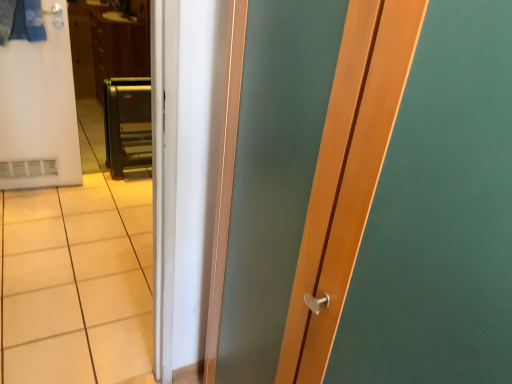
Where is `blank space above metallic gray step ladder at center (from a real-world perspective)`? The width and height of the screenshot is (512, 384). blank space above metallic gray step ladder at center (from a real-world perspective) is located at coordinates (127, 81).